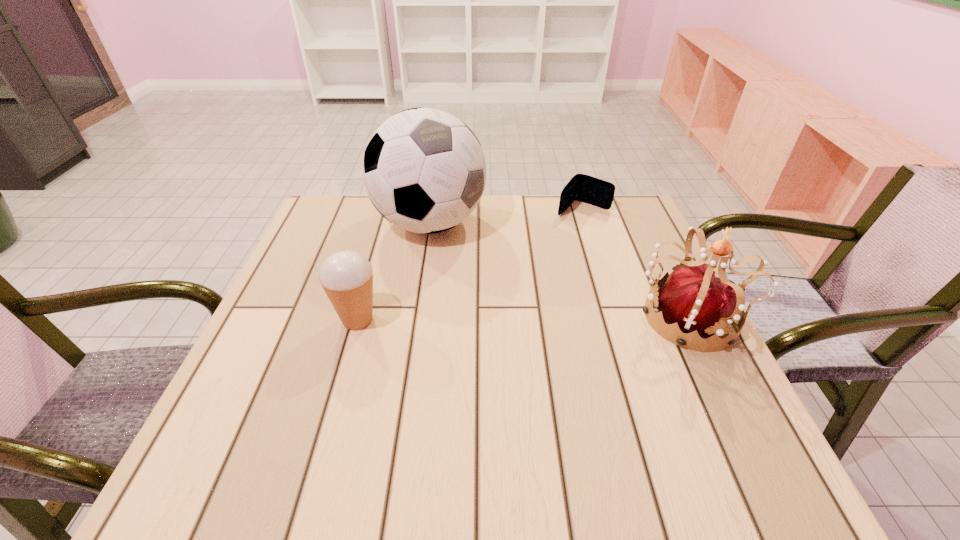
Where is `free point between the tiara and the tallest object`? The height and width of the screenshot is (540, 960). free point between the tiara and the tallest object is located at coordinates click(558, 271).

The image size is (960, 540). Identify the location of unoccupied area between the icecream and the tiara. (522, 319).

The height and width of the screenshot is (540, 960). In order to click on free area in between the shortest object and the third shortest object in this screenshot , I will do `click(635, 264)`.

You are a GUI agent. You are given a task and a screenshot of the screen. Output one action in this format:
    pyautogui.click(x=<x>, y=<y>)
    Task: Click on the unoccupied position between the tallest object and the tiara
    The width and height of the screenshot is (960, 540).
    Given the screenshot: What is the action you would take?
    pyautogui.click(x=558, y=271)

Select which object is the third closest to the soccer ball. Please provide its 2D coordinates. Your answer should be formatted as a tuple, i.e. [(x, y)], where the tuple contains the x and y coordinates of a point satisfying the conditions above.

[(691, 298)]

Locate an element on the screen. Image resolution: width=960 pixels, height=540 pixels. the second closest object to the shortest object is located at coordinates (691, 298).

At what (x,y) coordinates should I click in order to perform the action: click on vacant space that satisfies the following two spatial constraints: 1. on the front side of the tiara; 2. on the front-facing side of the soccer ball. Please return your answer as a coordinate pair (x, y). Looking at the image, I should click on (416, 318).

In order to click on free space that satisfies the following two spatial constraints: 1. on the front side of the tiara; 2. on the front-facing side of the wallet in this screenshot , I will do `click(618, 318)`.